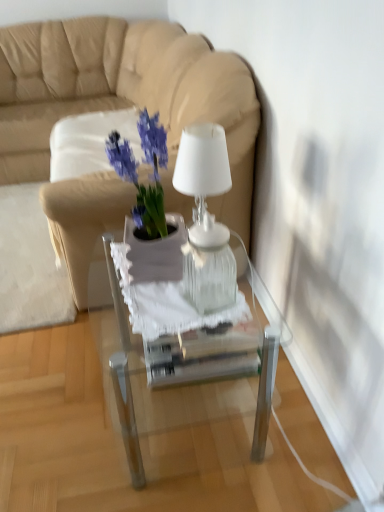
Question: Is transparent glass lamp at center inside clear glass table at center?

Choices:
 (A) no
 (B) yes

Answer: (A)

Question: Does clear glass table at center lie behind transparent glass lamp at center?

Choices:
 (A) yes
 (B) no

Answer: (A)

Question: Is the position of clear glass table at center less distant than that of transparent glass lamp at center?

Choices:
 (A) no
 (B) yes

Answer: (A)

Question: From a real-world perspective, does clear glass table at center sit lower than transparent glass lamp at center?

Choices:
 (A) yes
 (B) no

Answer: (A)

Question: Is clear glass table at center facing away from transparent glass lamp at center?

Choices:
 (A) no
 (B) yes

Answer: (A)

Question: From a real-world perspective, is matte purple plant at center above or below transparent glass box at center?

Choices:
 (A) below
 (B) above

Answer: (B)

Question: Considering their positions, is matte purple plant at center located in front of or behind transparent glass box at center?

Choices:
 (A) behind
 (B) front

Answer: (B)

Question: Does point (150, 135) appear closer or farther from the camera than point (196, 345)?

Choices:
 (A) closer
 (B) farther

Answer: (A)

Question: From the image's perspective, is matte purple plant at center positioned above or below transparent glass box at center?

Choices:
 (A) above
 (B) below

Answer: (A)

Question: Relative to clear glass table at center, is transparent glass lamp at center in front or behind?

Choices:
 (A) behind
 (B) front

Answer: (B)

Question: Looking at the image, does transparent glass lamp at center seem bigger or smaller compared to clear glass table at center?

Choices:
 (A) big
 (B) small

Answer: (B)

Question: Is point (198, 153) positioned closer to the camera than point (274, 351)?

Choices:
 (A) closer
 (B) farther

Answer: (A)

Question: Considering the positions of transparent glass lamp at center and clear glass table at center in the image, is transparent glass lamp at center taller or shorter than clear glass table at center?

Choices:
 (A) short
 (B) tall

Answer: (A)

Question: Does point (107, 158) appear closer or farther from the camera than point (44, 44)?

Choices:
 (A) closer
 (B) farther

Answer: (A)

Question: From the image's perspective, is matte purple plant at center located above or below beige leather couch at upper left?

Choices:
 (A) above
 (B) below

Answer: (B)